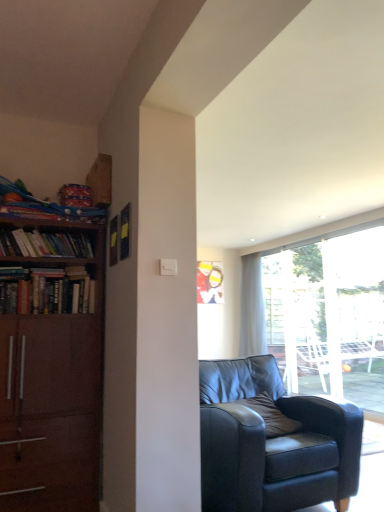
Question: Considering the relative sizes of matte black armchair at center and white sheer curtain at center in the image provided, is matte black armchair at center thinner than white sheer curtain at center?

Choices:
 (A) yes
 (B) no

Answer: (B)

Question: Is matte black armchair at center to the left of white sheer curtain at center from the viewer's perspective?

Choices:
 (A) yes
 (B) no

Answer: (A)

Question: Does matte black armchair at center have a greater width compared to white sheer curtain at center?

Choices:
 (A) no
 (B) yes

Answer: (B)

Question: Is matte black armchair at center facing towards white sheer curtain at center?

Choices:
 (A) no
 (B) yes

Answer: (A)

Question: From a real-world perspective, is matte black armchair at center located higher than white sheer curtain at center?

Choices:
 (A) yes
 (B) no

Answer: (B)

Question: Is matte black armchair at center at the right side of white sheer curtain at center?

Choices:
 (A) no
 (B) yes

Answer: (A)

Question: Can you see wooden bookshelf at left, positioned as the 2th book in top-to-bottom order, touching matte black armchair at center?

Choices:
 (A) yes
 (B) no

Answer: (B)

Question: Can you confirm if wooden bookshelf at left, which is the 1th book in bottom-to-top order, is shorter than matte black armchair at center?

Choices:
 (A) no
 (B) yes

Answer: (B)

Question: Is wooden bookshelf at left, positioned as the 2th book in top-to-bottom order, not within matte black armchair at center?

Choices:
 (A) no
 (B) yes

Answer: (B)

Question: Is wooden bookshelf at left, positioned as the 2th book in top-to-bottom order, bigger than matte black armchair at center?

Choices:
 (A) no
 (B) yes

Answer: (A)

Question: From the image's perspective, would you say wooden bookshelf at left, which is the 1th book in bottom-to-top order, is positioned over matte black armchair at center?

Choices:
 (A) no
 (B) yes

Answer: (B)

Question: From a real-world perspective, is wooden bookshelf at left, positioned as the 2th book in top-to-bottom order, located higher than matte black armchair at center?

Choices:
 (A) no
 (B) yes

Answer: (B)

Question: Does hardcover books at left, which ranks as the first book in top-to-bottom order, have a lesser width compared to matte black armchair at center?

Choices:
 (A) no
 (B) yes

Answer: (B)